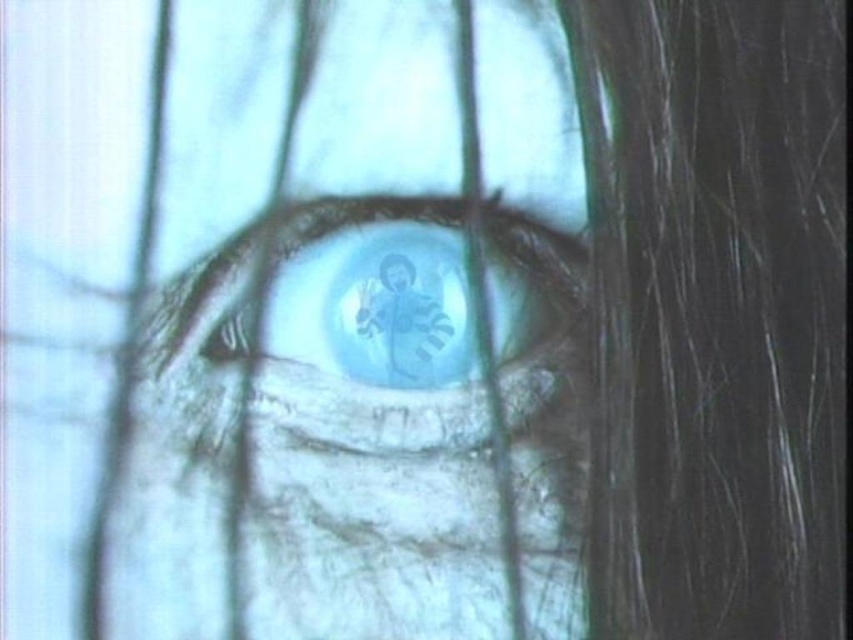
Question: Which point is closer to the camera?

Choices:
 (A) (219, 298)
 (B) (379, 458)

Answer: (A)

Question: Can you confirm if translucent glass eye at center is thinner than translucent blue eye at center?

Choices:
 (A) yes
 (B) no

Answer: (B)

Question: Which of the following is the closest to the observer?

Choices:
 (A) (489, 340)
 (B) (355, 330)

Answer: (B)

Question: Does translucent glass eye at center appear over translucent blue eye at center?

Choices:
 (A) no
 (B) yes

Answer: (A)

Question: Is translucent glass eye at center to the right of translucent blue eye at center from the viewer's perspective?

Choices:
 (A) no
 (B) yes

Answer: (B)